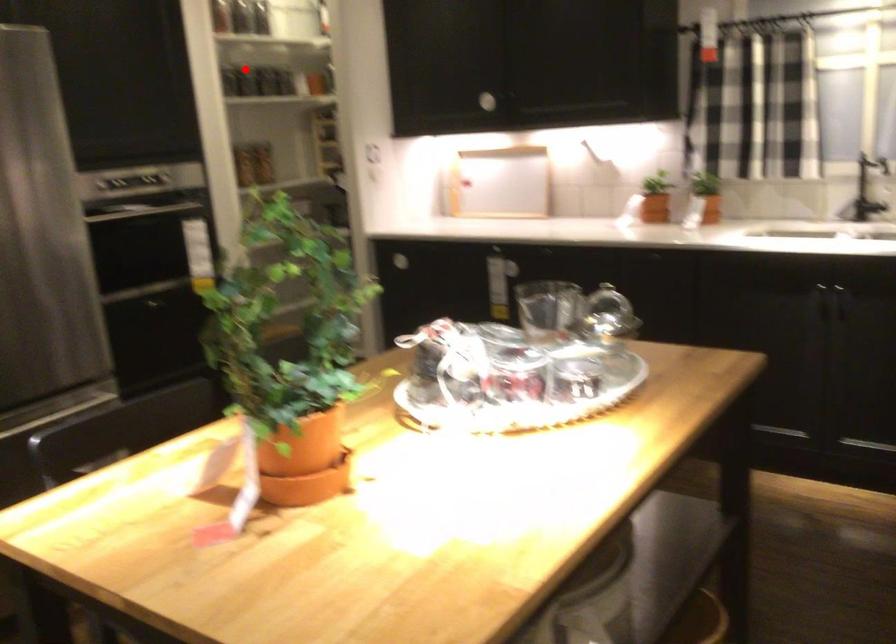
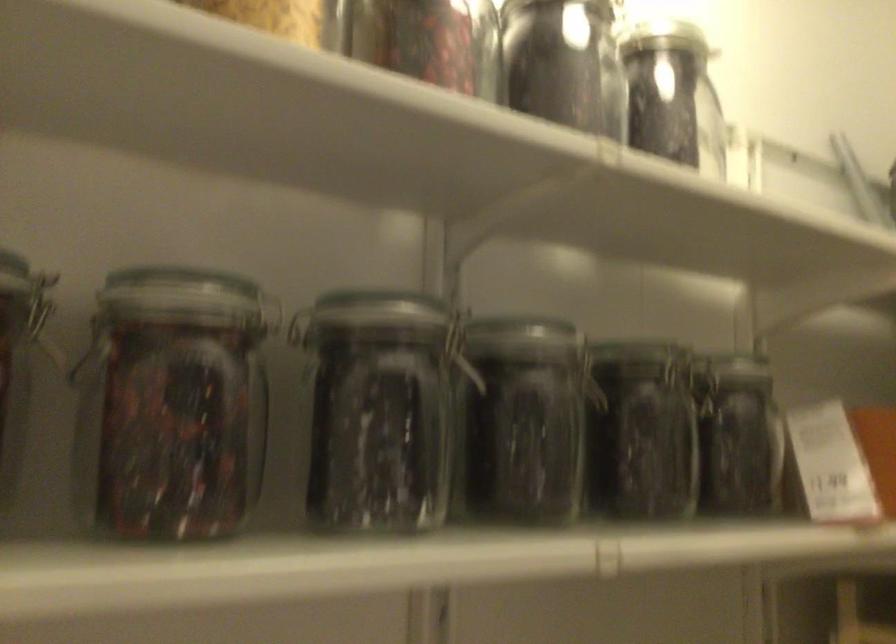
Where in the second image is the point corresponding to the highlighted location from the first image?

(524, 420)